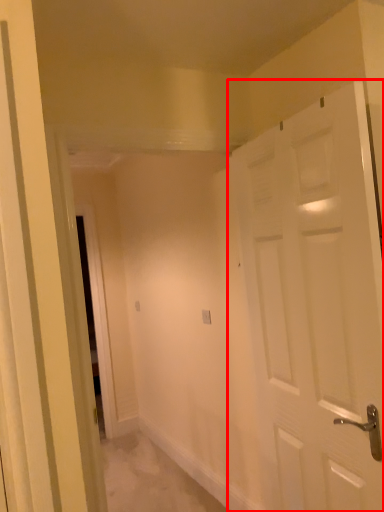
Question: From the image's perspective, considering the relative positions of door (annotated by the red box) and electric outlet in the image provided, where is door (annotated by the red box) located with respect to the staircase?

Choices:
 (A) above
 (B) below

Answer: (A)